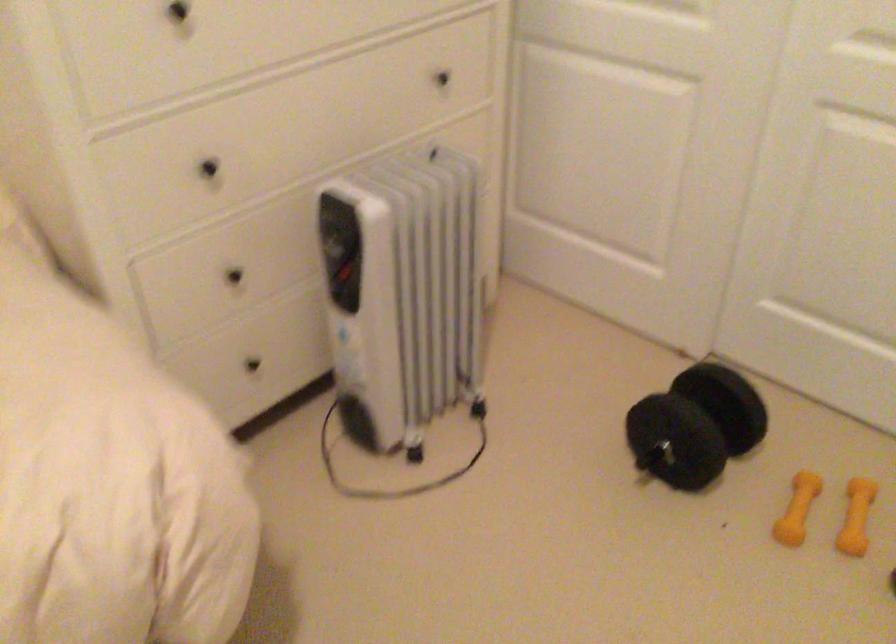
The location [695,426] corresponds to which object?

It corresponds to the black dumbbell in the image.